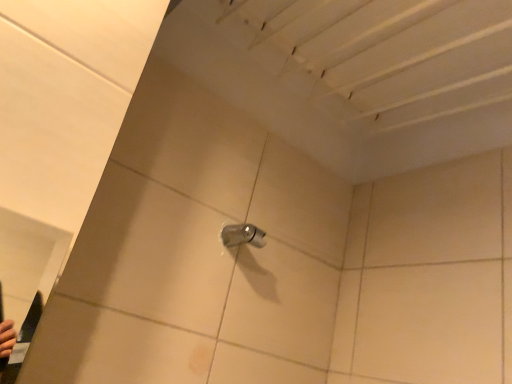
Measure the distance between satin nickel faucet at center and camera.

satin nickel faucet at center is 34.49 inches from camera.

Where is `satin nickel faucet at center`? This screenshot has height=384, width=512. satin nickel faucet at center is located at coordinates [x=242, y=235].

Measure the distance between point (241, 224) and camera.

Point (241, 224) is 37.36 inches away from camera.

Describe the element at coordinates (242, 235) in the screenshot. Image resolution: width=512 pixels, height=384 pixels. I see `satin nickel faucet at center` at that location.

The image size is (512, 384). In order to click on satin nickel faucet at center in this screenshot , I will do `click(242, 235)`.